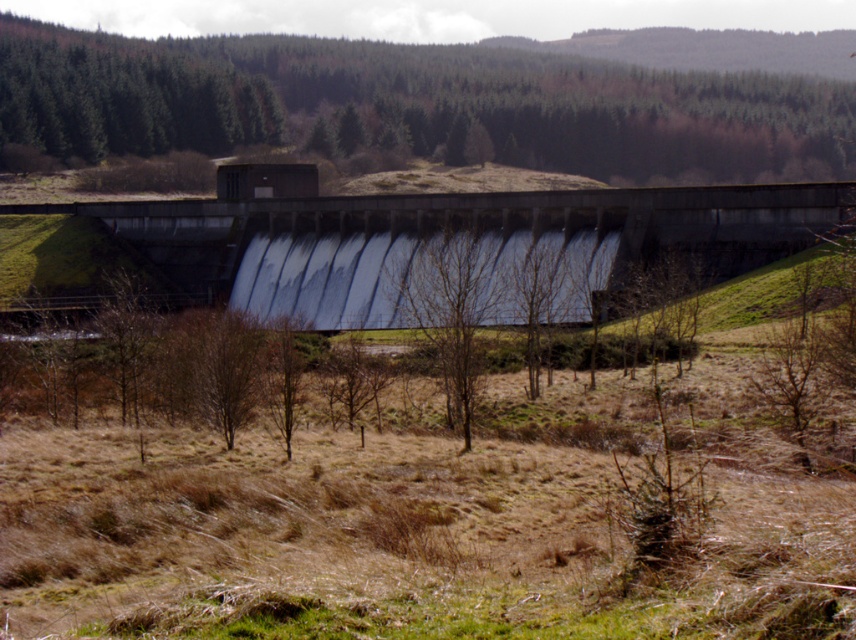
Does concrete dam at center appear on the right side of white smooth water at center?

Incorrect, concrete dam at center is not on the right side of white smooth water at center.

Who is more forward, (295,220) or (515,268)?

Positioned in front is point (515,268).

What are the coordinates of `concrete dam at center` in the screenshot? It's located at (455, 232).

The width and height of the screenshot is (856, 640). What do you see at coordinates (414, 106) in the screenshot? I see `green leafy tree at upper center` at bounding box center [414, 106].

What do you see at coordinates (414, 106) in the screenshot?
I see `green leafy tree at upper center` at bounding box center [414, 106].

Locate an element on the screen. The height and width of the screenshot is (640, 856). green leafy tree at upper center is located at coordinates (414, 106).

Can you confirm if white smooth water at center is shorter than bare wood tree at center?

Yes, white smooth water at center is shorter than bare wood tree at center.

Does white smooth water at center have a smaller size compared to bare wood tree at center?

No.

Does point (348, 262) come behind point (471, 321)?

Yes, point (348, 262) is farther from viewer.

Where is `white smooth water at center`? white smooth water at center is located at coordinates (331, 278).